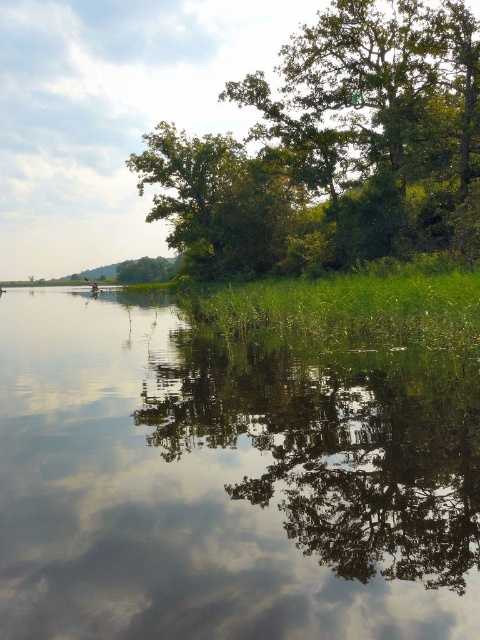
You are standing at the edge of the water and want to place a small floating decoration. The decoration requires a space larger than the transparent water at center. Can you use the area near the green leafy tree at upper center instead?

The transparent water at center has a smaller size compared to green leafy tree at upper center, so the area near the green leafy tree at upper center is larger. Therefore, the decoration can be placed there since it requires a space larger than the transparent water at center.

You are standing on the bank of the water and see the transparent water at center and the green leafy tree at upper center. Which object is located to the left of the other?

The transparent water at center is positioned on the left side of green leafy tree at upper center.

You are standing at the edge of the water and want to walk to both the point labeled as point (417, 547) and the point labeled as point (418, 212). Which point will you reach first?

You will reach point (417, 547) first because it is closer to you than point (418, 212).